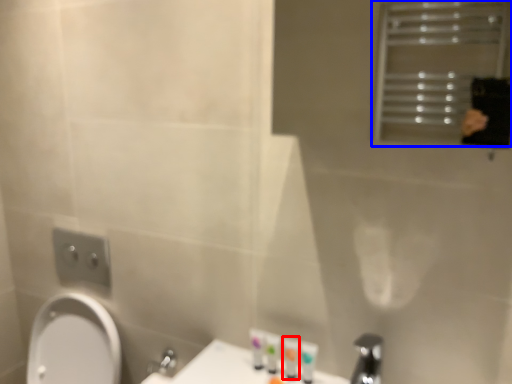
Question: Which point is further to the camera, toiletry (highlighted by a red box) or screen door (highlighted by a blue box)?

Choices:
 (A) toiletry
 (B) screen door

Answer: (A)